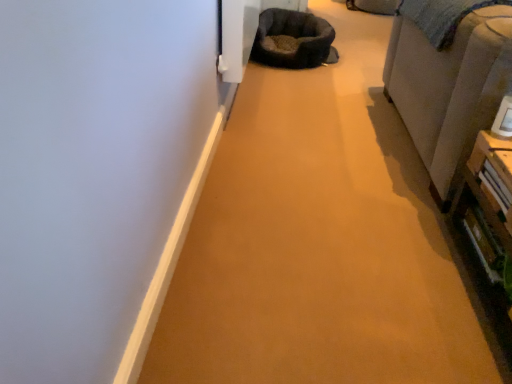
Question: From a real-world perspective, is beige fabric couch at right under dark brown plush bean bag chair at upper center?

Choices:
 (A) yes
 (B) no

Answer: (B)

Question: Is beige fabric couch at right thinner than dark brown plush bean bag chair at upper center?

Choices:
 (A) yes
 (B) no

Answer: (B)

Question: Is beige fabric couch at right next to dark brown plush bean bag chair at upper center?

Choices:
 (A) no
 (B) yes

Answer: (A)

Question: Does beige fabric couch at right have a larger size compared to dark brown plush bean bag chair at upper center?

Choices:
 (A) yes
 (B) no

Answer: (A)

Question: From the image's perspective, is beige fabric couch at right over dark brown plush bean bag chair at upper center?

Choices:
 (A) no
 (B) yes

Answer: (A)

Question: Is beige fabric couch at right facing towards dark brown plush bean bag chair at upper center?

Choices:
 (A) no
 (B) yes

Answer: (A)

Question: Can beige fabric couch at right be found inside dark brown plush bean bag chair at upper center?

Choices:
 (A) no
 (B) yes

Answer: (A)

Question: Can you confirm if dark brown plush bean bag chair at upper center is bigger than beige fabric couch at right?

Choices:
 (A) no
 (B) yes

Answer: (A)

Question: From the image's perspective, does dark brown plush bean bag chair at upper center appear higher than beige fabric couch at right?

Choices:
 (A) no
 (B) yes

Answer: (B)

Question: Does dark brown plush bean bag chair at upper center have a greater width compared to beige fabric couch at right?

Choices:
 (A) yes
 (B) no

Answer: (B)

Question: From a real-world perspective, is dark brown plush bean bag chair at upper center physically above beige fabric couch at right?

Choices:
 (A) no
 (B) yes

Answer: (A)

Question: From a real-world perspective, does dark brown plush bean bag chair at upper center sit lower than beige fabric couch at right?

Choices:
 (A) yes
 (B) no

Answer: (A)

Question: In terms of height, does dark brown plush bean bag chair at upper center look taller or shorter compared to beige fabric couch at right?

Choices:
 (A) short
 (B) tall

Answer: (A)